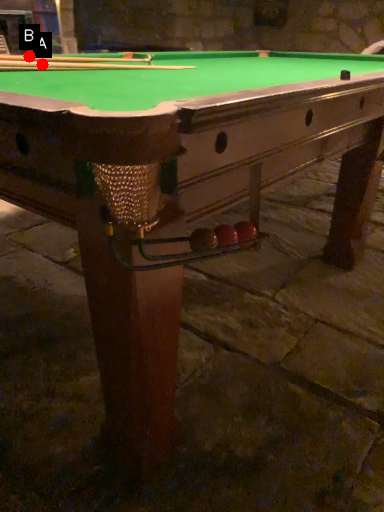
Question: Two points are circled on the image, labeled by A and B beside each circle. Which point is further to the camera?

Choices:
 (A) A is further
 (B) B is further

Answer: (B)